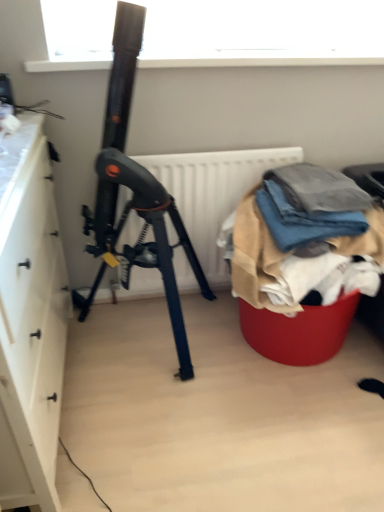
Question: Is white matte radiator at center taller than white matte cabinet at left?

Choices:
 (A) no
 (B) yes

Answer: (A)

Question: Does white matte radiator at center come behind white matte cabinet at left?

Choices:
 (A) yes
 (B) no

Answer: (A)

Question: Does white matte radiator at center come in front of white matte cabinet at left?

Choices:
 (A) no
 (B) yes

Answer: (A)

Question: Is there a large distance between white matte radiator at center and white matte cabinet at left?

Choices:
 (A) no
 (B) yes

Answer: (A)

Question: Does white matte radiator at center have a lesser width compared to white matte cabinet at left?

Choices:
 (A) yes
 (B) no

Answer: (A)

Question: Considering the positions of white matte cabinet at left and denim fabric at right in the image, is white matte cabinet at left wider or thinner than denim fabric at right?

Choices:
 (A) thin
 (B) wide

Answer: (B)

Question: Is point (31, 358) positioned closer to the camera than point (276, 206)?

Choices:
 (A) farther
 (B) closer

Answer: (B)

Question: Looking at the image, does white matte cabinet at left seem bigger or smaller compared to denim fabric at right?

Choices:
 (A) small
 (B) big

Answer: (B)

Question: Based on their positions, is white matte cabinet at left located to the left or right of denim fabric at right?

Choices:
 (A) left
 (B) right

Answer: (A)

Question: Is point (294, 217) positioned closer to the camera than point (266, 272)?

Choices:
 (A) closer
 (B) farther

Answer: (B)

Question: Considering the relative positions of denim fabric at right and textured fabric pile at lower right in the image provided, is denim fabric at right to the left or to the right of textured fabric pile at lower right?

Choices:
 (A) left
 (B) right

Answer: (A)

Question: Considering the positions of denim fabric at right and textured fabric pile at lower right in the image, is denim fabric at right bigger or smaller than textured fabric pile at lower right?

Choices:
 (A) big
 (B) small

Answer: (B)

Question: In terms of width, does denim fabric at right look wider or thinner when compared to textured fabric pile at lower right?

Choices:
 (A) wide
 (B) thin

Answer: (B)

Question: Considering their positions, is textured fabric pile at lower right located in front of or behind denim fabric at right?

Choices:
 (A) front
 (B) behind

Answer: (A)

Question: From the image's perspective, is textured fabric pile at lower right located above or below denim fabric at right?

Choices:
 (A) below
 (B) above

Answer: (A)